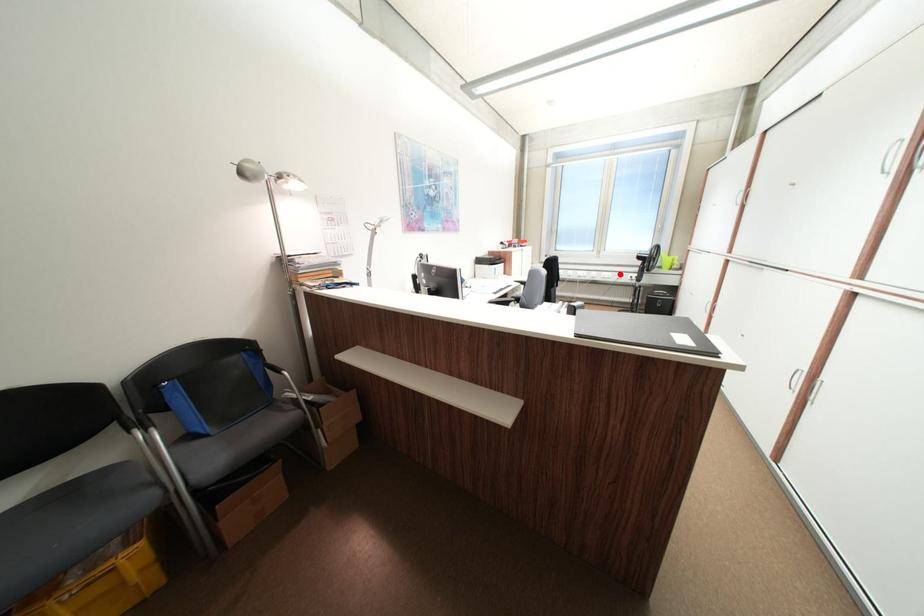
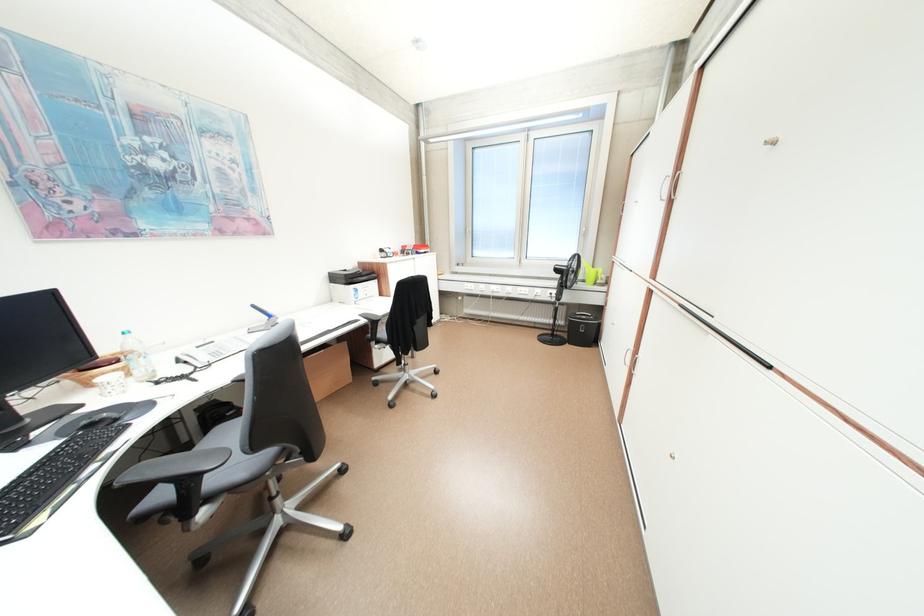
In the second image, find the point that corresponds to the highlighted location in the first image.

(537, 290)